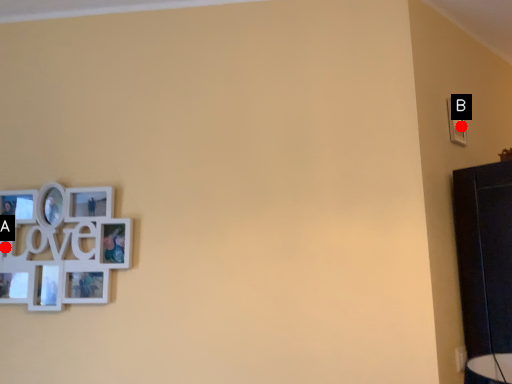
Question: Two points are circled on the image, labeled by A and B beside each circle. Among these points, which one is nearest to the camera?

Choices:
 (A) A is closer
 (B) B is closer

Answer: (A)